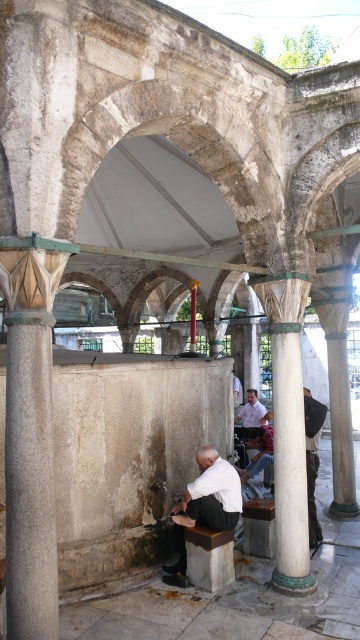
Who is more forward, (162,566) or (258,420)?

Positioned in front is point (162,566).

Consider the image. Is white matte shirt at center closer to the viewer compared to light brown leather jacket at center?

Yes, white matte shirt at center is closer to the viewer.

Which is in front, point (186, 502) or point (254, 422)?

Point (186, 502)

What are the coordinates of `white matte shirt at center` in the screenshot? It's located at (204, 506).

Between point (281, 388) and point (257, 424), which one is positioned in front?

Positioned in front is point (281, 388).

From the picture: Which is above, white marble column at center or light brown leather jacket at center?

white marble column at center is higher up.

Between point (288, 540) and point (259, 413), which one is positioned behind?

The point (259, 413) is behind.

At what (x,y) coordinates should I click in order to perform the action: click on white marble column at center. Please return your answer as a coordinate pair (x, y). This screenshot has width=360, height=640. Looking at the image, I should click on (288, 428).

Does white marble column at center appear over white matte shirt at center?

Yes.

Which is in front, point (284, 540) or point (218, 476)?

Positioned in front is point (284, 540).

The height and width of the screenshot is (640, 360). Identify the location of white marble column at center. (288, 428).